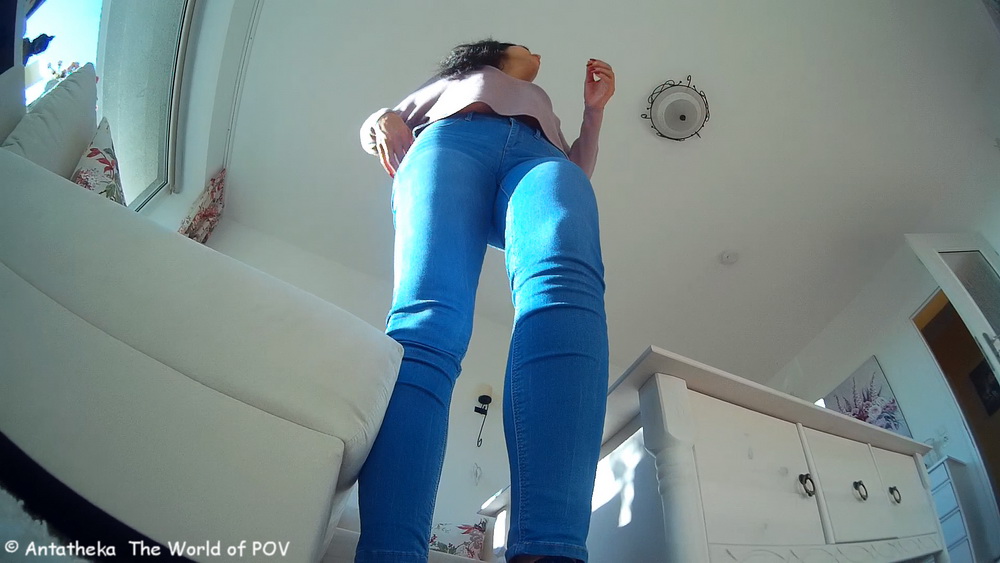
Locate an element on the screen. This screenshot has height=563, width=1000. smoke detector is located at coordinates (729, 259).